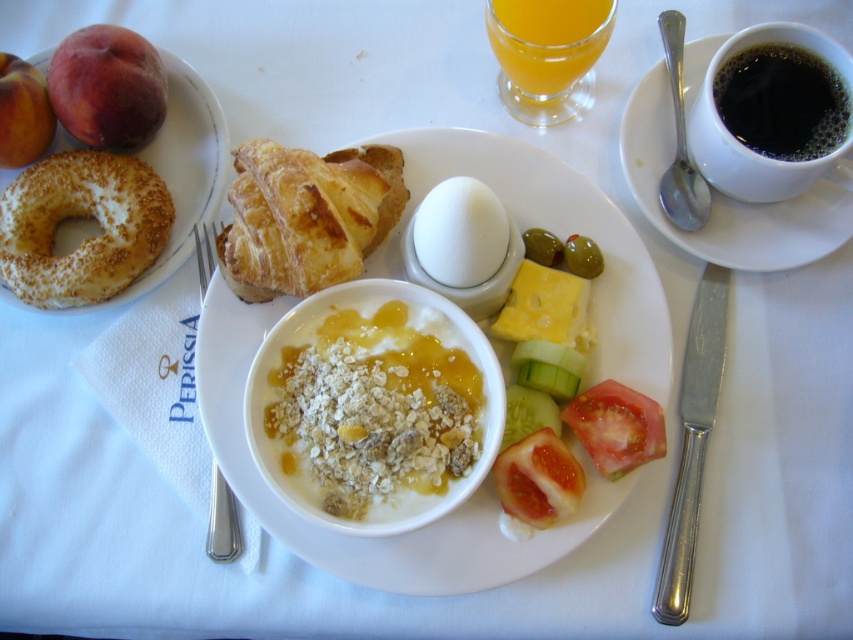
This screenshot has height=640, width=853. What do you see at coordinates (373, 538) in the screenshot?
I see `white smooth bowl at center` at bounding box center [373, 538].

Can you confirm if white smooth bowl at center is shorter than red smooth tomato at lower center?

No, white smooth bowl at center is not shorter than red smooth tomato at lower center.

Describe the element at coordinates (373, 538) in the screenshot. I see `white smooth bowl at center` at that location.

At what (x,y) coordinates should I click in order to perform the action: click on white smooth bowl at center. Please return your answer as a coordinate pair (x, y). The image size is (853, 640). Looking at the image, I should click on (373, 538).

Can you confirm if white smooth bowl at center is positioned above slightly toasted bagel at left?

Incorrect, white smooth bowl at center is not positioned above slightly toasted bagel at left.

How much distance is there between white smooth bowl at center and slightly toasted bagel at left?

A distance of 9.95 inches exists between white smooth bowl at center and slightly toasted bagel at left.

Identify the location of white smooth bowl at center. The height and width of the screenshot is (640, 853). (373, 538).

Does black liquid coffee at upper right appear over red smooth tomato at lower center?

Yes, black liquid coffee at upper right is above red smooth tomato at lower center.

Describe the element at coordinates (782, 100) in the screenshot. The width and height of the screenshot is (853, 640). I see `black liquid coffee at upper right` at that location.

Find the location of a particular element. black liquid coffee at upper right is located at coordinates (782, 100).